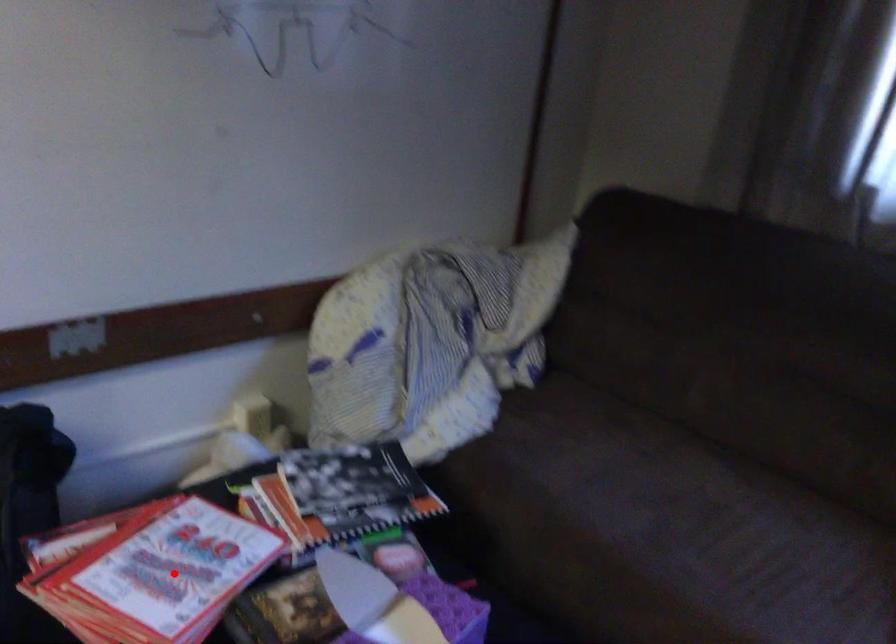
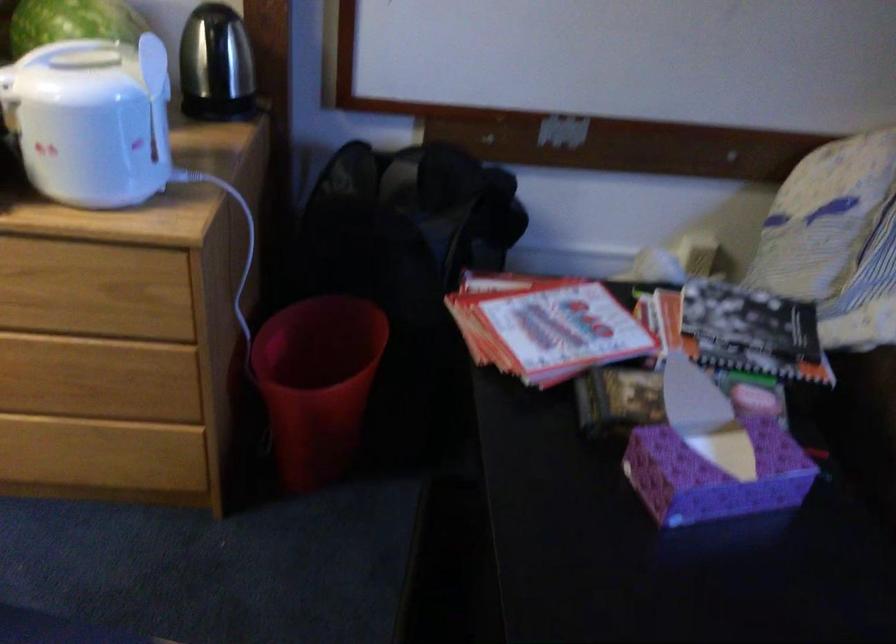
Question: I am providing you with two images of the same scene from different viewpoints. Given a red point in image1, look at the same physical point in image2. Is it:

Choices:
 (A) Closer to the viewpoint
 (B) Farther from the viewpoint

Answer: (B)